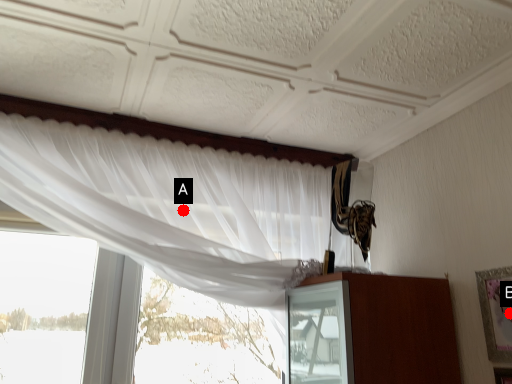
Question: Two points are circled on the image, labeled by A and B beside each circle. Which point is closer to the camera?

Choices:
 (A) A is closer
 (B) B is closer

Answer: (B)